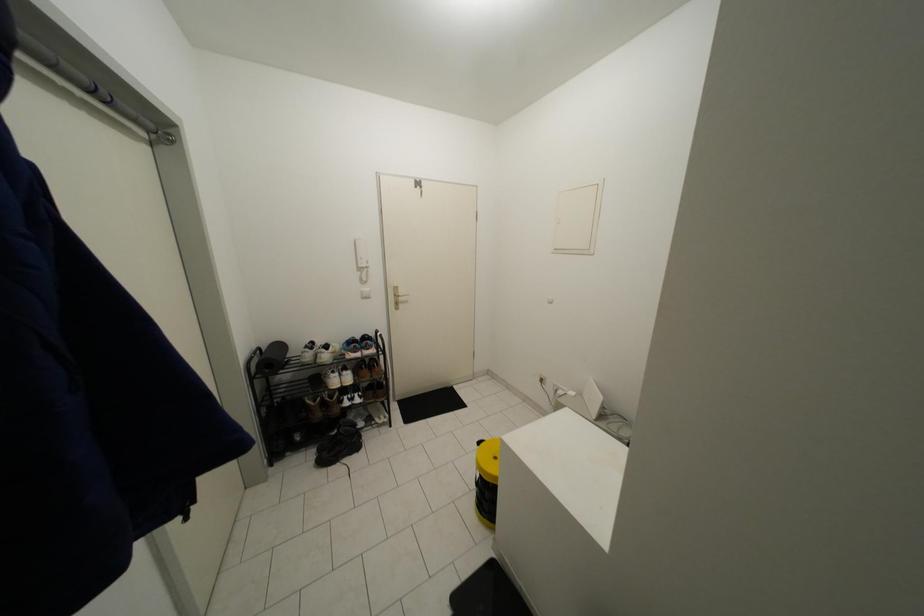
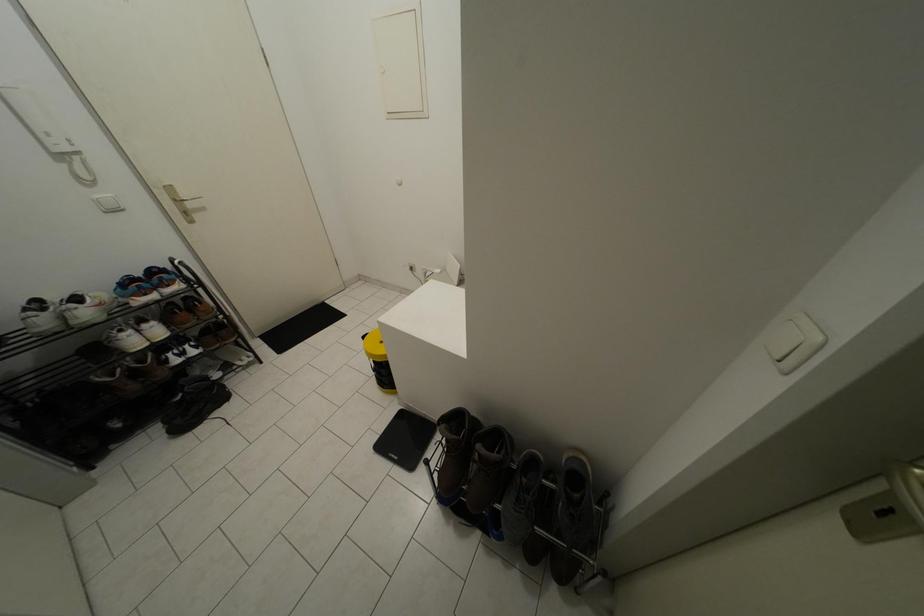
The images are taken continuously from a first-person perspective. In which direction is your viewpoint rotating?

The rotation direction of the camera is right-down.